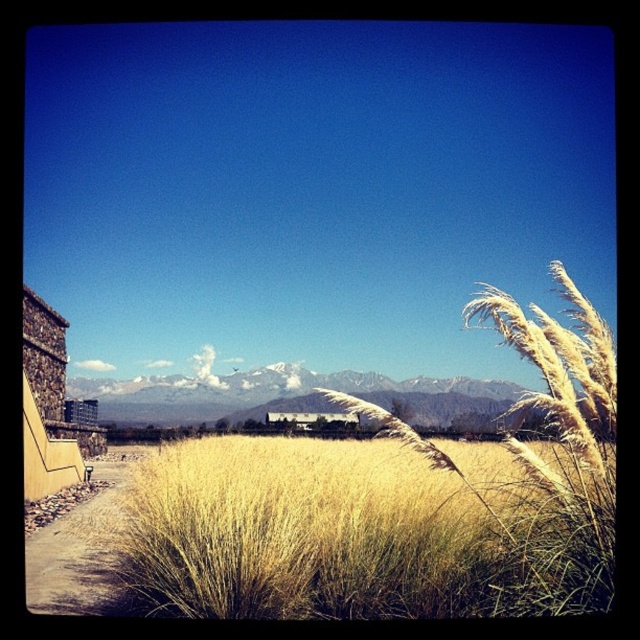
Question: Which point is farther to the camera?

Choices:
 (A) yellow grass at center
 (B) brown gravel path at lower left

Answer: (B)

Question: Among these objects, which one is farthest from the camera?

Choices:
 (A) yellow grass at center
 (B) brown gravel path at lower left

Answer: (B)

Question: Is yellow grass at center behind brown gravel path at lower left?

Choices:
 (A) yes
 (B) no

Answer: (B)

Question: Is yellow grass at center closer to the viewer compared to brown gravel path at lower left?

Choices:
 (A) no
 (B) yes

Answer: (B)

Question: Which of the following is the closest to the observer?

Choices:
 (A) (371, 602)
 (B) (81, 577)

Answer: (A)

Question: Does yellow grass at center have a lesser width compared to brown gravel path at lower left?

Choices:
 (A) no
 (B) yes

Answer: (B)